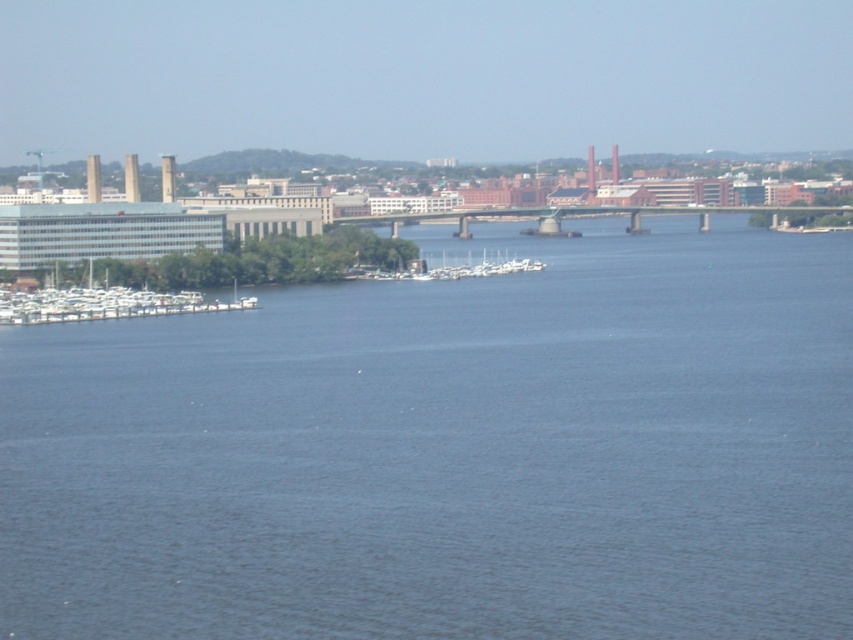
Question: Is the position of white matte boats at left more distant than that of white matte boats at center?

Choices:
 (A) no
 (B) yes

Answer: (B)

Question: Which is nearer to the white matte boats at center?

Choices:
 (A) blue water at center
 (B) white matte boats at left

Answer: (B)

Question: Considering the relative positions of white matte boats at left and white matte boats at center in the image provided, where is white matte boats at left located with respect to white matte boats at center?

Choices:
 (A) above
 (B) below

Answer: (B)

Question: Which object is positioned closest to the white matte boats at left?

Choices:
 (A) white matte boats at center
 (B) blue water at center

Answer: (A)

Question: Which point is closer to the camera?

Choices:
 (A) white matte boats at center
 (B) blue water at center

Answer: (B)

Question: Is blue water at center closer to the viewer compared to white matte boats at center?

Choices:
 (A) no
 (B) yes

Answer: (B)